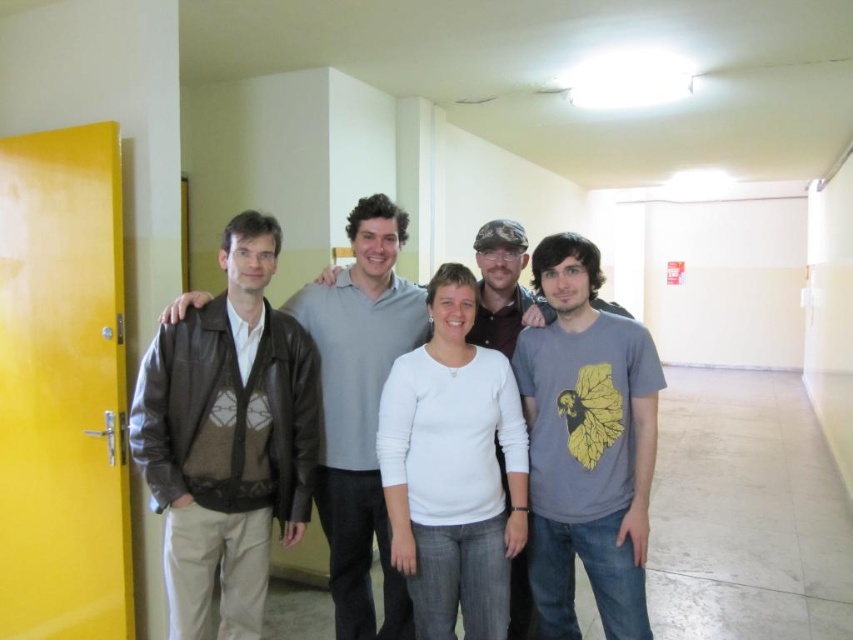
Question: Based on their relative distances, which object is nearer to the gray matte t-shirt at center?

Choices:
 (A) gray matte shirt at center
 (B) white matte shirt at center
 (C) leather jacket at left

Answer: (B)

Question: Can you confirm if leather jacket at left is positioned to the left of gray matte shirt at center?

Choices:
 (A) no
 (B) yes

Answer: (B)

Question: Which point is closer to the camera?

Choices:
 (A) (424, 321)
 (B) (503, 241)
 (C) (631, 572)
 (D) (407, 416)

Answer: (C)

Question: Which object is closer to the camera taking this photo?

Choices:
 (A) white matte shirt at center
 (B) leather jacket at left
 (C) gray matte t-shirt at center

Answer: (C)

Question: Can you confirm if white matte shirt at center is positioned to the right of gray matte shirt at center?

Choices:
 (A) no
 (B) yes

Answer: (A)

Question: Is gray matte t-shirt at center to the right of white matte shirt at center from the viewer's perspective?

Choices:
 (A) yes
 (B) no

Answer: (A)